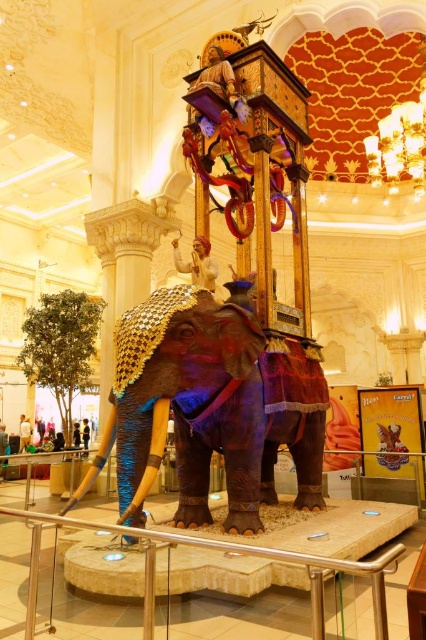
Is shiny purple fabric elephant at center to the right of satin silver railing at center from the viewer's perspective?

Indeed, shiny purple fabric elephant at center is positioned on the right side of satin silver railing at center.

Is point (170, 404) farther from camera compared to point (233, 548)?

That is True.

You are a GUI agent. You are given a task and a screenshot of the screen. Output one action in this format:
    pyautogui.click(x=<x>, y=<y>)
    Task: Click on the shiny purple fabric elephant at center
    Image resolution: width=426 pixels, height=640 pixels.
    Given the screenshot: What is the action you would take?
    pyautogui.click(x=213, y=404)